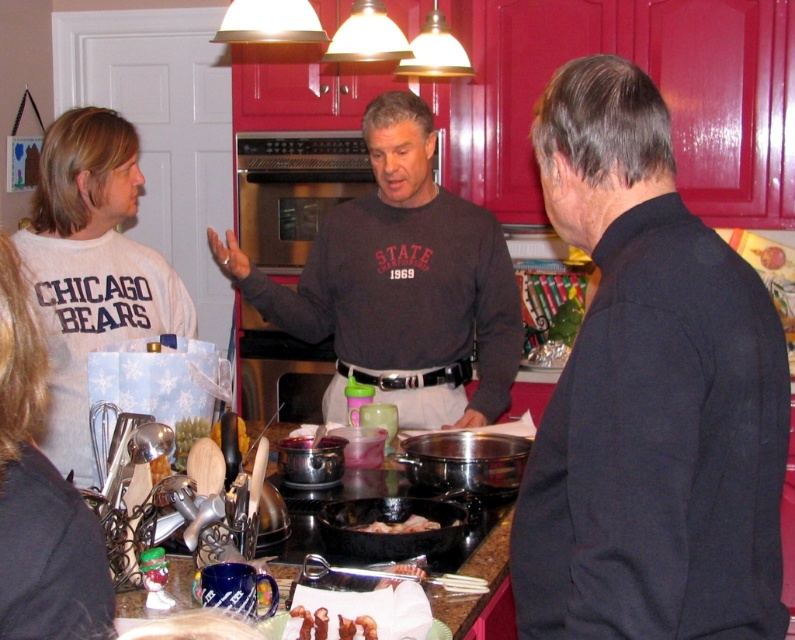
Who is taller, white cotton t-shirt at left or white fabric shirt at left?

white cotton t-shirt at left

Is point (87, 246) behind point (22, 477)?

That is True.

Is point (45, 227) positioned before point (95, 544)?

No, it is not.

You are a GUI agent. You are given a task and a screenshot of the screen. Output one action in this format:
    pyautogui.click(x=<x>, y=<y>)
    Task: Click on the white cotton t-shirt at left
    The width and height of the screenshot is (795, 640).
    Given the screenshot: What is the action you would take?
    pyautogui.click(x=91, y=268)

Who is taller, dark gray sweatshirt at center or golden crispy bacon at center?

dark gray sweatshirt at center

Locate an element on the screen. This screenshot has height=640, width=795. dark gray sweatshirt at center is located at coordinates [401, 284].

Does dark gray sweatshirt at center have a larger size compared to white cotton t-shirt at left?

Indeed, dark gray sweatshirt at center has a larger size compared to white cotton t-shirt at left.

Does dark gray sweatshirt at center appear on the left side of white cotton t-shirt at left?

In fact, dark gray sweatshirt at center is to the right of white cotton t-shirt at left.

What do you see at coordinates (401, 284) in the screenshot?
I see `dark gray sweatshirt at center` at bounding box center [401, 284].

Locate an element on the screen. This screenshot has height=640, width=795. dark gray sweatshirt at center is located at coordinates (401, 284).